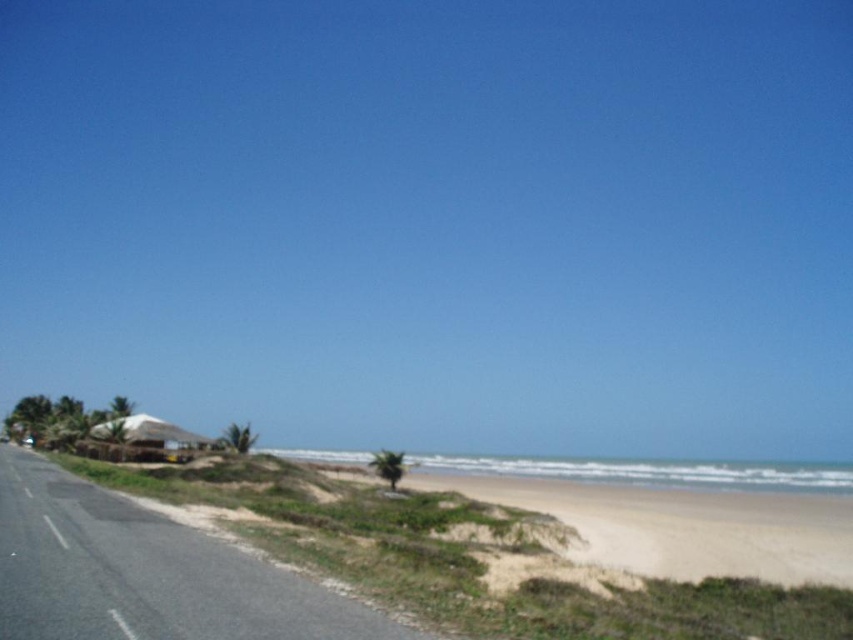
From the picture: You are a photographer trying to capture a sunset shot. You have a tripod that needs to be placed on the light beige sand at lower right and the white thatched hut at lower left. Since the sunset is approaching, you want to know which area is higher to ensure the tripod has a stable base. Can you tell me which one is higher?

The light beige sand at lower right has a greater height compared to the white thatched hut at lower left, so placing the tripod on the light beige sand at lower right would provide a more stable base due to its higher elevation.

You are standing at the center of the paved road on the left side of the image. You want to walk directly towards the white thatched hut at lower left. Will you pass by the light beige sand at lower right on your way?

No, because the light beige sand at lower right is located below the white thatched hut at lower left, so walking towards the hut would not require passing over the light beige sand at lower right.